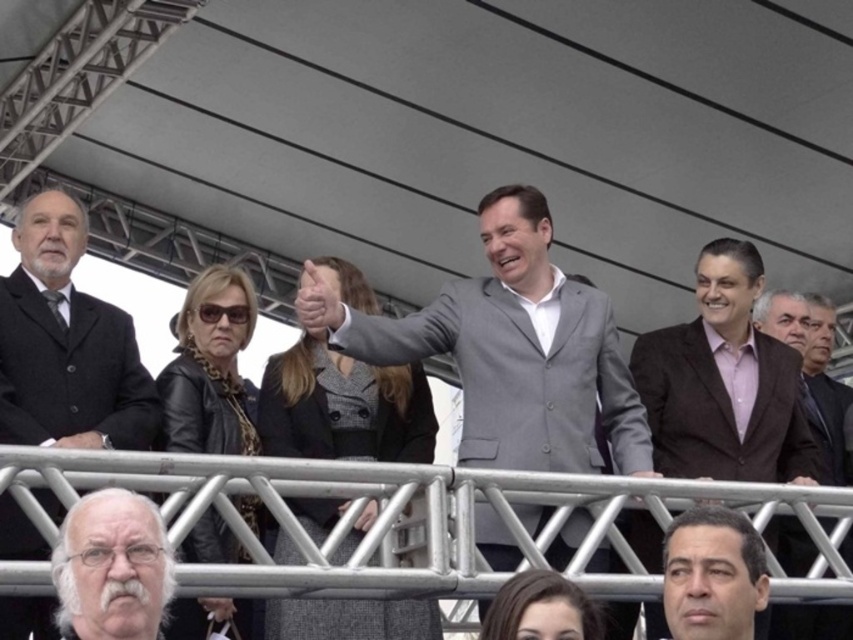
Can you confirm if brown textured suit at right is bigger than gray woolen blazer at center?

Correct, brown textured suit at right is larger in size than gray woolen blazer at center.

Who is taller, brown textured suit at right or gray woolen blazer at center?

Standing taller between the two is brown textured suit at right.

Is point (764, 381) behind point (325, 604)?

That is True.

The image size is (853, 640). What are the coordinates of `brown textured suit at right` in the screenshot? It's located at (724, 381).

Between silver metallic rail at center and gray woolen blazer at center, which one has more height?

Standing taller between the two is gray woolen blazer at center.

Can you confirm if silver metallic rail at center is wider than gray woolen blazer at center?

Correct, the width of silver metallic rail at center exceeds that of gray woolen blazer at center.

Who is more distant from viewer, (804, 580) or (403, 384)?

Positioned behind is point (403, 384).

The image size is (853, 640). What are the coordinates of `silver metallic rail at center` in the screenshot? It's located at (416, 518).

Which is below, silver metallic rail at center or gray suit at center?

silver metallic rail at center is lower down.

Does silver metallic rail at center appear over gray suit at center?

No, silver metallic rail at center is not above gray suit at center.

Which is in front, point (787, 499) or point (538, 438)?

Point (787, 499) is in front.

You are a GUI agent. You are given a task and a screenshot of the screen. Output one action in this format:
    pyautogui.click(x=<x>, y=<y>)
    Task: Click on the silver metallic rail at center
    This screenshot has width=853, height=640.
    Given the screenshot: What is the action you would take?
    pyautogui.click(x=416, y=518)